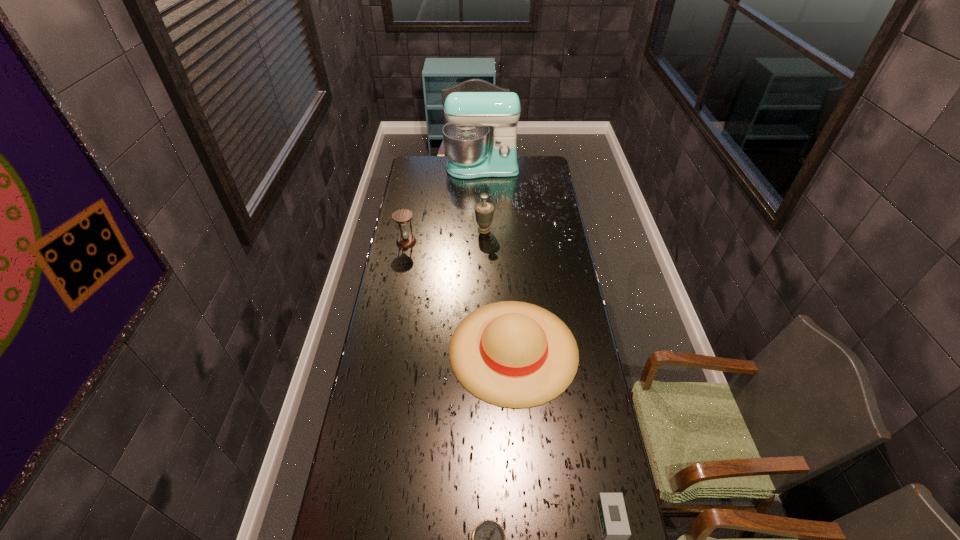
Where is `free space that satisfies the following two spatial constraints: 1. at the base of the sombrero; 2. on the left side of the farthest object`? Image resolution: width=960 pixels, height=540 pixels. free space that satisfies the following two spatial constraints: 1. at the base of the sombrero; 2. on the left side of the farthest object is located at coordinates (483, 350).